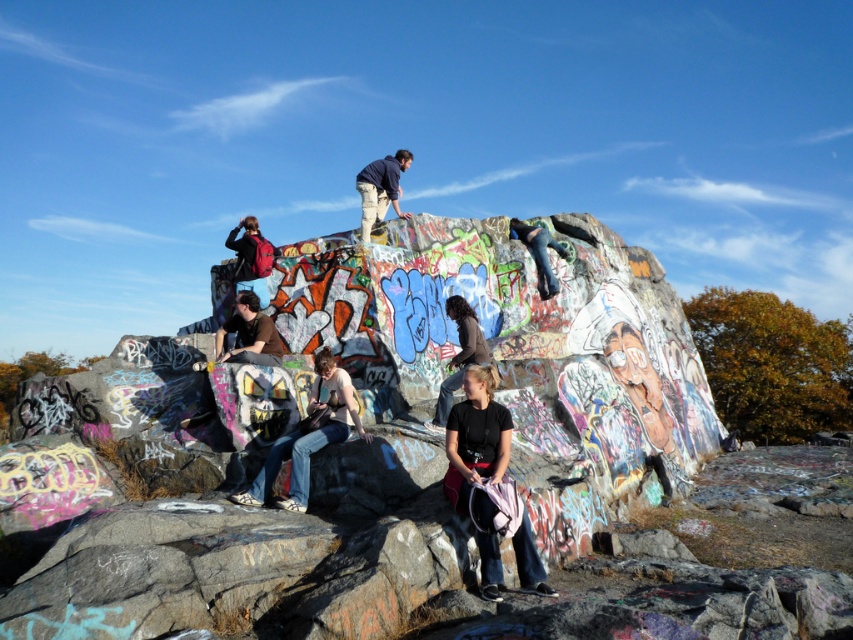
You are standing in front of the graffiti rock formation and want to determine the relative positions of two points marked on the rock. Which point, point 1 at coordinates (454,385) or point 2 at coordinates (256,221), is closer to you?

Point 1 at coordinates (454,385) is closer to the viewer than point 2 at coordinates (256,221).

You are a photographer positioned at the base of the rock formation. You want to capture both the denim jeans at center and the dark brown leather jacket at center in the same frame. Which object should you ensure is closer to the camera to include both in the photo?

The denim jeans at center is in front of the dark brown leather jacket at center, so to include both in the photo, ensure the denim jeans at center is closer to the camera.

You are a photographer standing at the base of the rock formation and notice both the dark brown leather jacket at center and the matte red backpack at center. Which object is closer to you?

The dark brown leather jacket at center is 27.28 meters away from the matte red backpack at center, so the dark brown leather jacket at center is closer to you since it is only 27.28 meters away from the backpack.